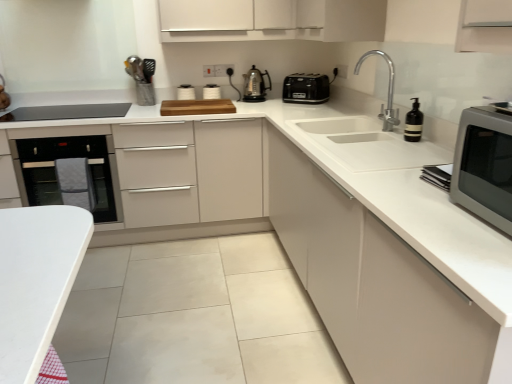
Question: Which direction should I rotate to look at satin nickel kettle at center, acting as the 1th kitchen appliance starting from the left?

Choices:
 (A) right
 (B) left

Answer: (A)

Question: Should I look upward or downward to see polished chrome faucet at upper right?

Choices:
 (A) down
 (B) up

Answer: (B)

Question: Would you say white glossy toaster at upper center contains white matte cabinet at center, the 1th cabinetry when ordered from left to right?

Choices:
 (A) no
 (B) yes

Answer: (A)

Question: Does white glossy toaster at upper center turn towards white matte cabinet at center, which ranks as the 3th cabinetry in right-to-left order?

Choices:
 (A) no
 (B) yes

Answer: (B)

Question: Considering the relative sizes of white glossy toaster at upper center and white matte cabinet at center, the 1th cabinetry when ordered from left to right, in the image provided, is white glossy toaster at upper center thinner than white matte cabinet at center, the 1th cabinetry when ordered from left to right,?

Choices:
 (A) no
 (B) yes

Answer: (B)

Question: Does white glossy toaster at upper center have a greater height compared to white matte cabinet at center, the 1th cabinetry when ordered from left to right?

Choices:
 (A) yes
 (B) no

Answer: (B)

Question: Considering the relative sizes of white glossy toaster at upper center and white matte cabinet at center, which ranks as the 3th cabinetry in right-to-left order, in the image provided, is white glossy toaster at upper center shorter than white matte cabinet at center, which ranks as the 3th cabinetry in right-to-left order,?

Choices:
 (A) yes
 (B) no

Answer: (A)

Question: From a real-world perspective, is white glossy toaster at upper center on white matte cabinet at center, the 1th cabinetry when ordered from left to right?

Choices:
 (A) yes
 (B) no

Answer: (A)

Question: Does white matte cabinet at center, which appears as the first cabinetry when viewed from the right, come behind white matte cabinet at center, the 1th cabinetry when ordered from left to right?

Choices:
 (A) no
 (B) yes

Answer: (A)

Question: From a real-world perspective, is white matte cabinet at center, which appears as the first cabinetry when viewed from the right, beneath white matte cabinet at center, which ranks as the 3th cabinetry in right-to-left order?

Choices:
 (A) yes
 (B) no

Answer: (B)

Question: Is white matte cabinet at center, marked as the third cabinetry in a left-to-right arrangement, far away from white matte cabinet at center, the 1th cabinetry when ordered from left to right?

Choices:
 (A) yes
 (B) no

Answer: (A)

Question: From the image's perspective, is white matte cabinet at center, which appears as the first cabinetry when viewed from the right, on top of white matte cabinet at center, which ranks as the 3th cabinetry in right-to-left order?

Choices:
 (A) no
 (B) yes

Answer: (A)

Question: Is white matte cabinet at center, which appears as the first cabinetry when viewed from the right, oriented towards white matte cabinet at center, which ranks as the 3th cabinetry in right-to-left order?

Choices:
 (A) yes
 (B) no

Answer: (A)

Question: Can you confirm if white matte cabinet at center, marked as the third cabinetry in a left-to-right arrangement, is positioned to the right of white matte cabinet at center, which ranks as the 3th cabinetry in right-to-left order?

Choices:
 (A) no
 (B) yes

Answer: (B)

Question: Is black glass oven at left bigger than white glossy toaster at upper center?

Choices:
 (A) yes
 (B) no

Answer: (A)